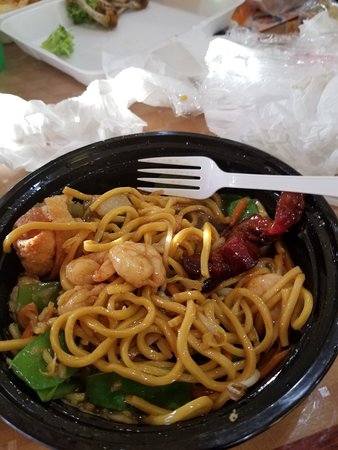
Find the location of `table`. table is located at coordinates (10, 82).